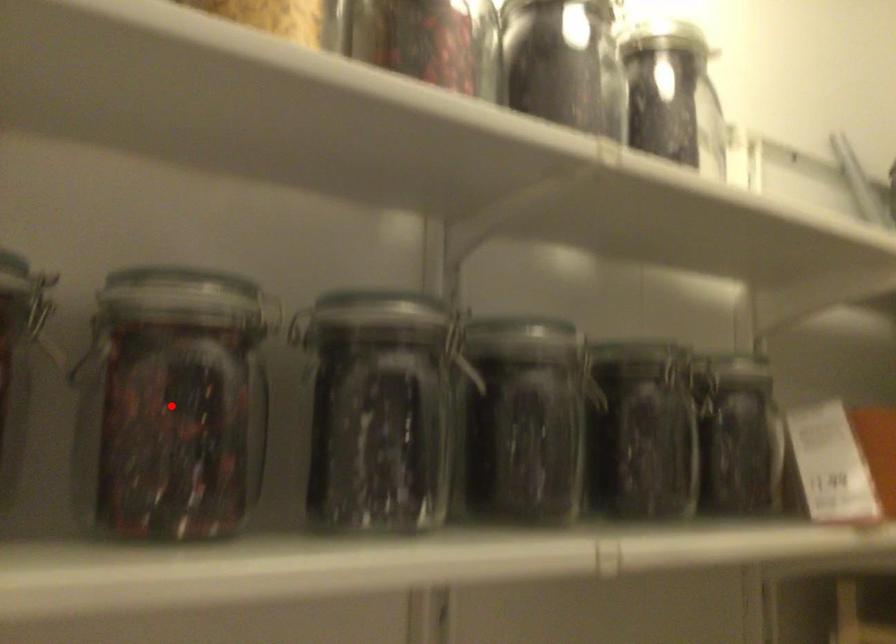
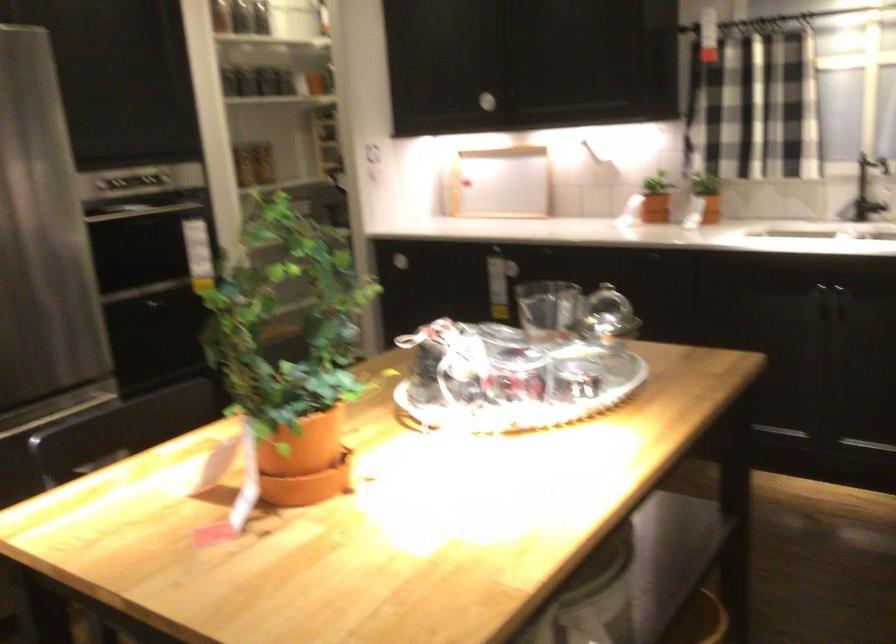
Question: I am providing you with two images of the same scene from different viewpoints. A red point is marked on the first image. Can you still see the location of the red point in image 2?

Choices:
 (A) Yes
 (B) No

Answer: (B)